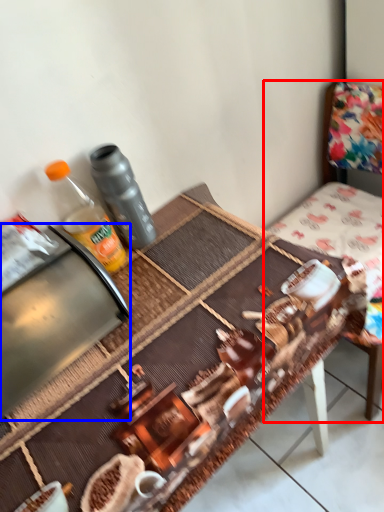
Question: Which of the following is the closest to the observer, chair (highlighted by a red box) or appliance (highlighted by a blue box)?

Choices:
 (A) chair
 (B) appliance

Answer: (B)